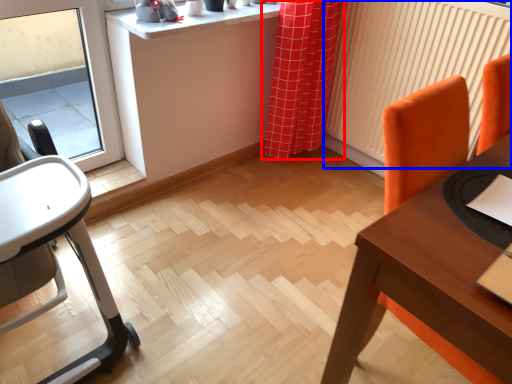
Question: Which of the following is the farthest to the observer, curtain (highlighted by a red box) or radiator (highlighted by a blue box)?

Choices:
 (A) curtain
 (B) radiator

Answer: (A)